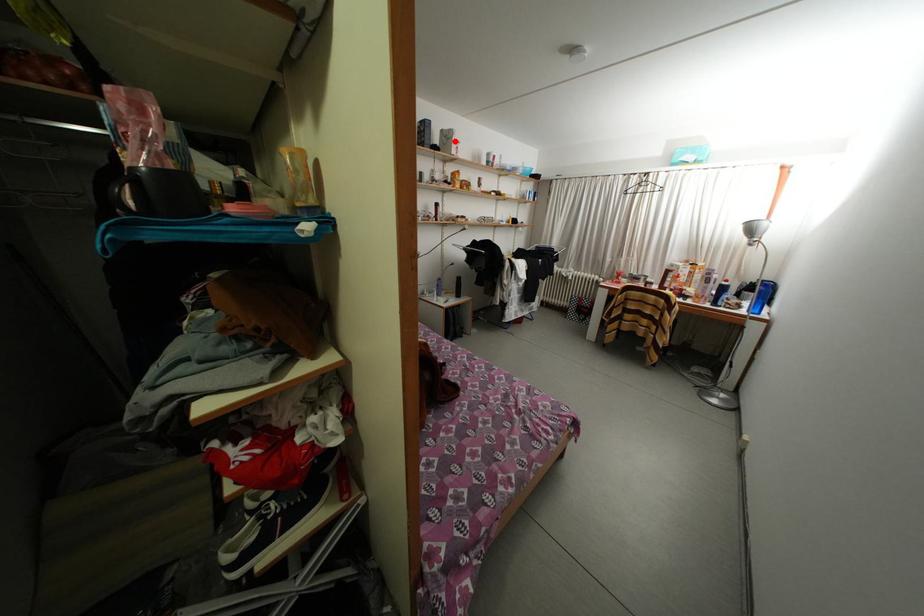
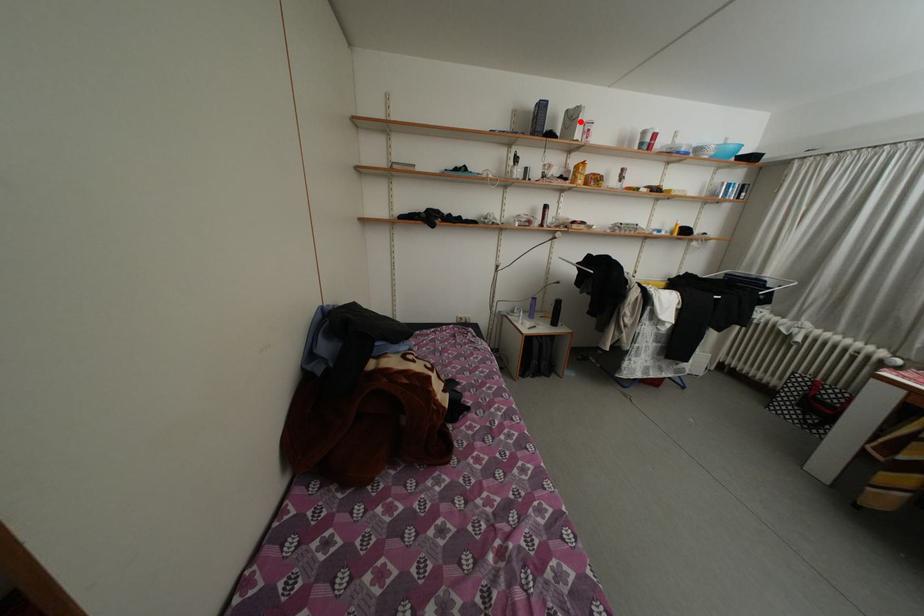
I am providing you with two images of the same scene from different viewpoints. A red point is marked on the first image and another point is marked on the second image. Are the points marked in image1 and image2 representing the same 3D position?

Yes